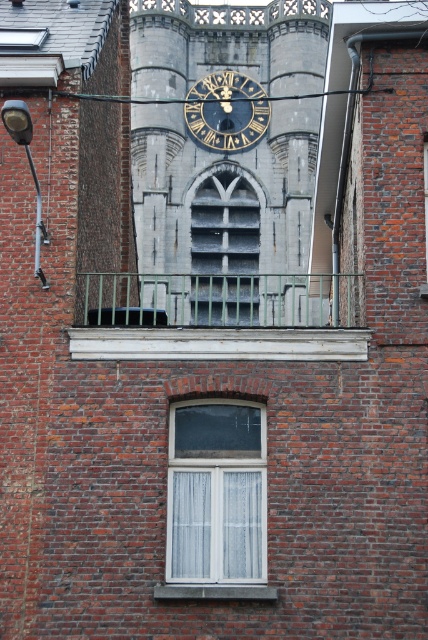
You are standing in front of the building and want to take a photo of both the gray stone clock tower at center and the white plastic window at center. Which object should you focus on first to ensure both are in the frame?

You should focus on the gray stone clock tower at center first because it is closer to you than the white plastic window at center, so adjusting the camera to include it will naturally include the window behind it as well.

You are standing in front of the brick building with the clock tower. There are two points marked on the facade. The first point is at coordinates point [240,449] and the second is at point [329,93]. If you were to throw a small ball from your current position towards these points, which point would the ball reach first?

The ball would reach point [240,449] first because it is closer to the viewer than point [329,93].